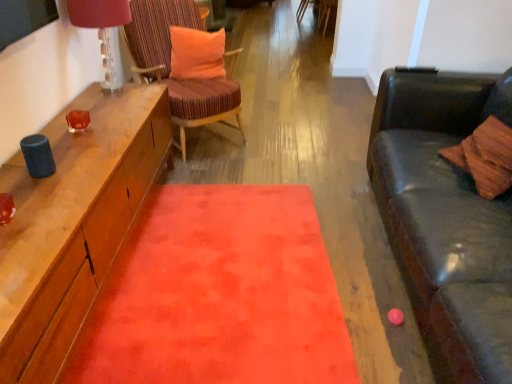
The image size is (512, 384). Identify the location of free location to the right of striped fabric chair at center. (280, 139).